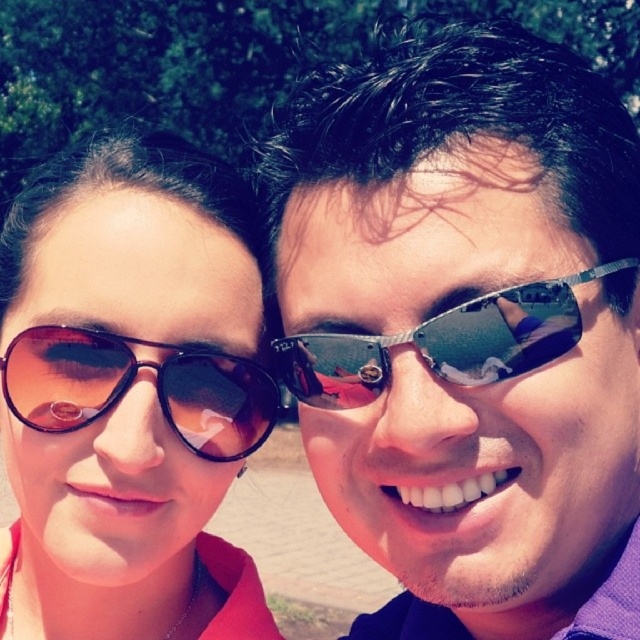
Question: Does matte black sunglasses at left lie behind matte black goggles at left?

Choices:
 (A) yes
 (B) no

Answer: (B)

Question: Which object appears closest to the camera in this image?

Choices:
 (A) matte black sunglasses at left
 (B) shiny metallic sunglasses at center
 (C) matte black goggles at left

Answer: (B)

Question: Can you confirm if matte black sunglasses at left is thinner than shiny metallic sunglasses at center?

Choices:
 (A) yes
 (B) no

Answer: (B)

Question: Which object is positioned farthest from the matte black goggles at left?

Choices:
 (A) shiny metallic sunglasses at center
 (B) matte black sunglasses at left

Answer: (A)

Question: Where is matte black sunglasses at left located in relation to shiny metallic sunglasses at center in the image?

Choices:
 (A) right
 (B) left

Answer: (B)

Question: Which object appears closest to the camera in this image?

Choices:
 (A) matte black goggles at left
 (B) matte black sunglasses at left
 (C) shiny metallic sunglasses at center

Answer: (C)